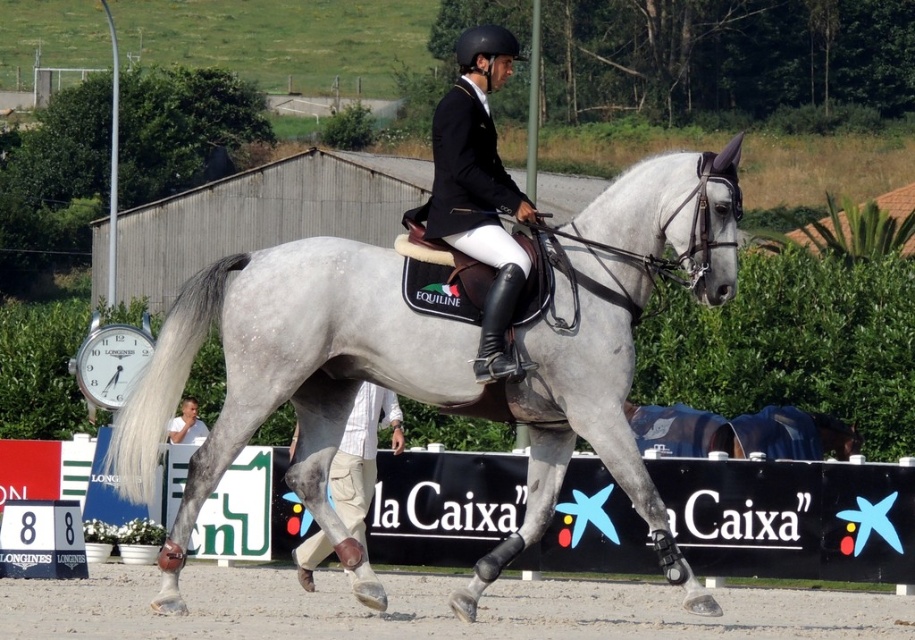
You are a photographer standing at the edge of the equestrian arena. You want to take a photo of the black leather jacket at center and the gray sand at center. How far apart are these two objects in the image?

The gray sand at center is 6.07 meters away from the black leather jacket at center, so the distance between them is 6.07 meters.